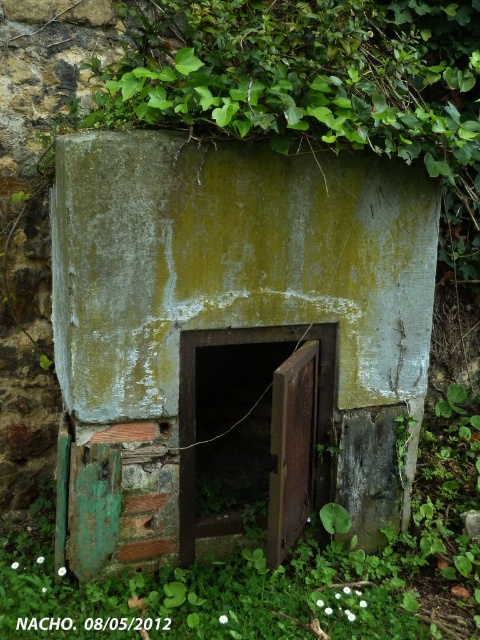
Between point (241, 208) and point (434, 611), which one is positioned in front?

Positioned in front is point (241, 208).

Who is positioned more to the right, green weathered concrete door at center or green mossy leaves at center?

green mossy leaves at center

The width and height of the screenshot is (480, 640). Identify the location of green weathered concrete door at center. (233, 333).